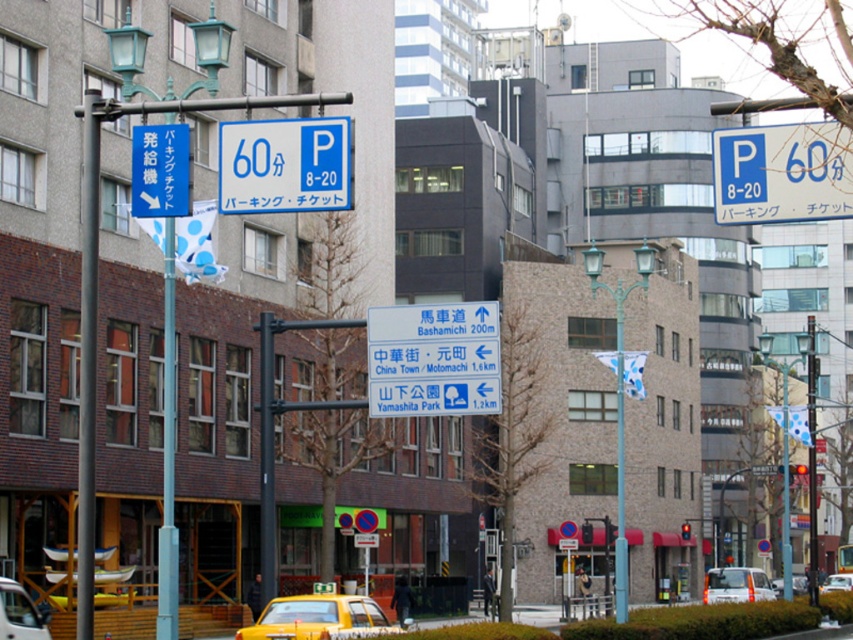
You are standing at the point marked as point (228,200) in the image, which is 18.41 meters away from the camera. You want to walk to the nearest landmark among Bashamichi, China Town, and Yamashita Park. According to the distances listed on the sign, which one is closest?

The distances listed on the sign are 200m for Bashamichi, 1.6km for China Town, and 1.2km for Yamashita Park. The closest is Bashamichi at 200m.

You are a pedestrian standing at the intersection and see the yellow matte taxi cab at lower left and the yellow plastic car at center. Which car is positioned more to the left side of the street?

The yellow matte taxi cab at lower left is positioned more to the left side of the street than the yellow plastic car at center.

You are a tourist in Japan and you see a blue plastic parking sign at upper right with a point marked at coordinates (782, 172). Where exactly is this point located on the sign?

The point at (782, 172) is located on the blue plastic parking sign at upper right.